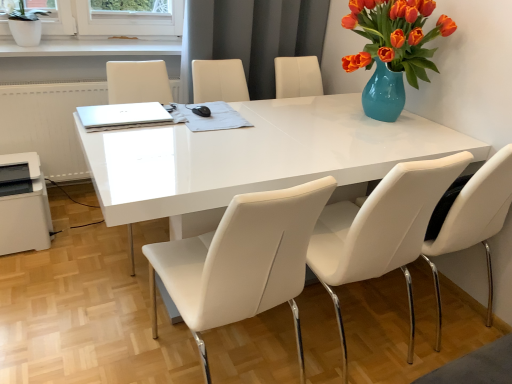
Where is `vacant space underneath white leather chair at center, placed as the second chair when sorted from left to right (from a real-world perspective)`? This screenshot has width=512, height=384. vacant space underneath white leather chair at center, placed as the second chair when sorted from left to right (from a real-world perspective) is located at coordinates (350, 345).